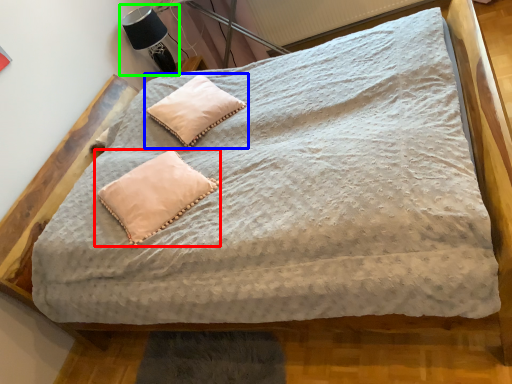
Question: Which is nearer to the pillow (highlighted by a red box)? pillow (highlighted by a blue box) or table lamp (highlighted by a green box).

Choices:
 (A) pillow
 (B) table lamp

Answer: (A)